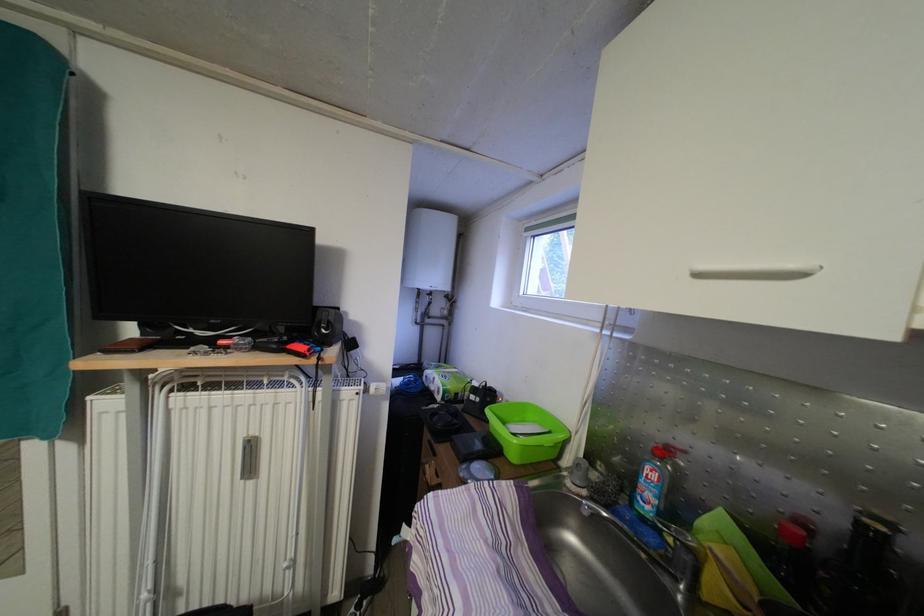
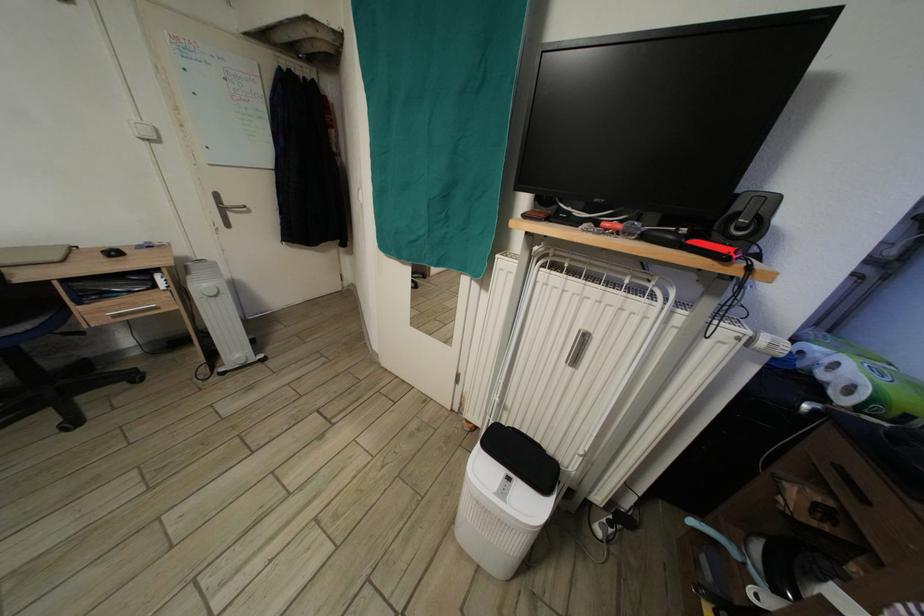
Find the pixel in the second image that matches (281,353) in the first image.

(675, 245)